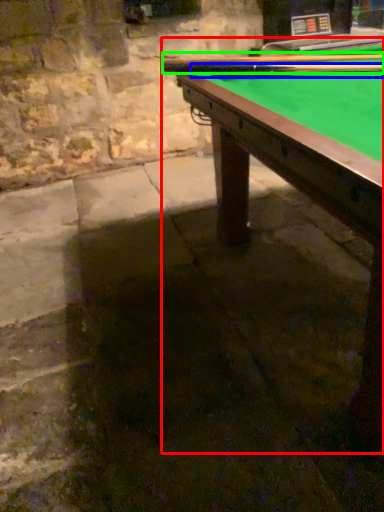
Question: Based on their relative distances, which object is farther from billiard table (highlighted by a red box)? Choose from cue (highlighted by a blue box) and cue (highlighted by a green box).

Choices:
 (A) cue
 (B) cue

Answer: (B)